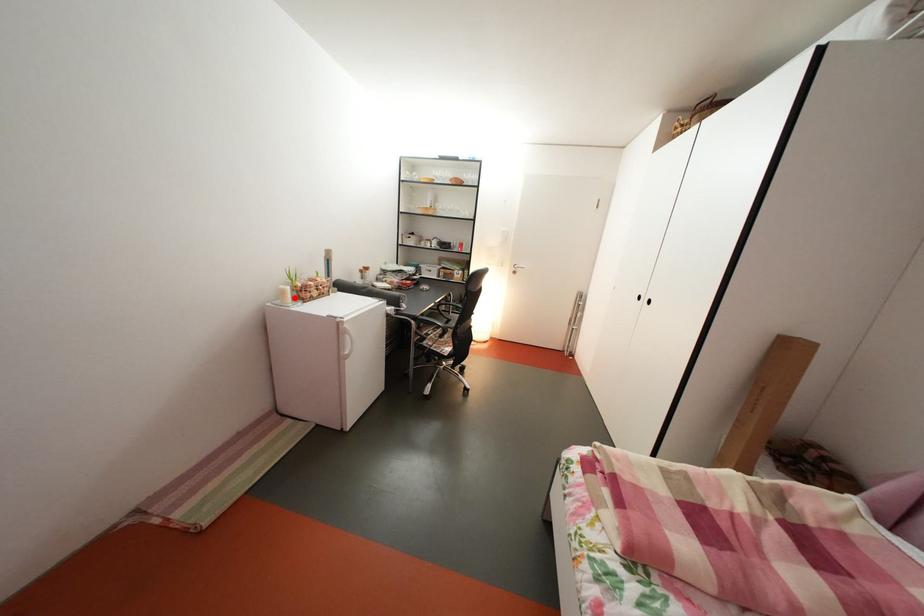
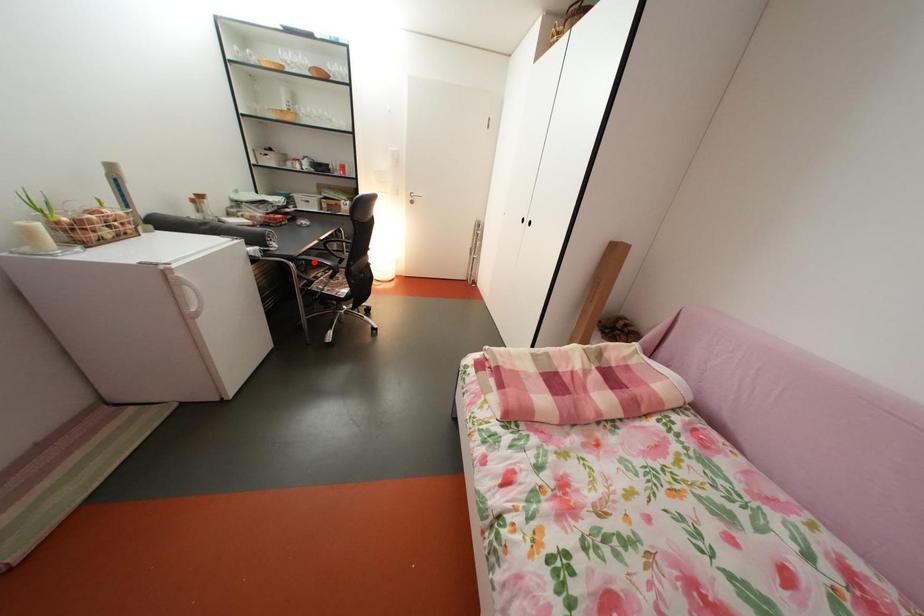
I am providing you with two images of the same scene from different viewpoints. A red point is marked on the first image and another point is marked on the second image. Is the red point in image1 aligned with the point shown in image2?

No